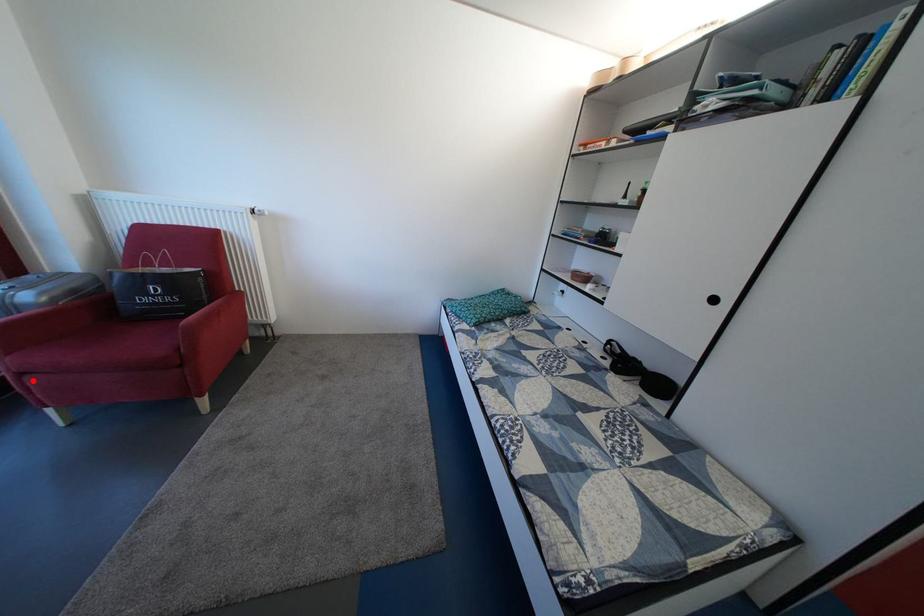
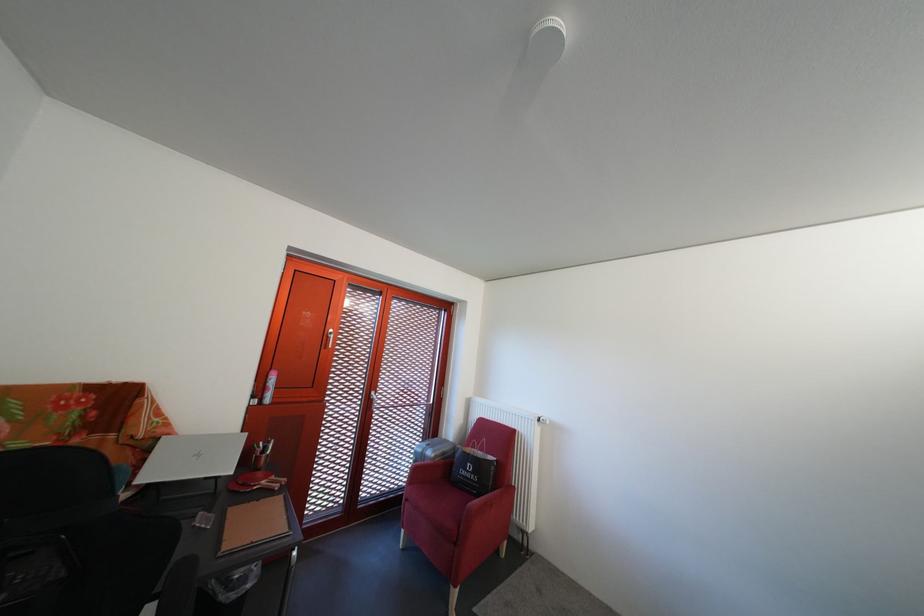
Question: I am providing you with two images of the same scene from different viewpoints. In image1, a red point is highlighted. Considering the same 3D point in image2, which of the following is correct?

Choices:
 (A) It is closer
 (B) It is farther

Answer: (B)